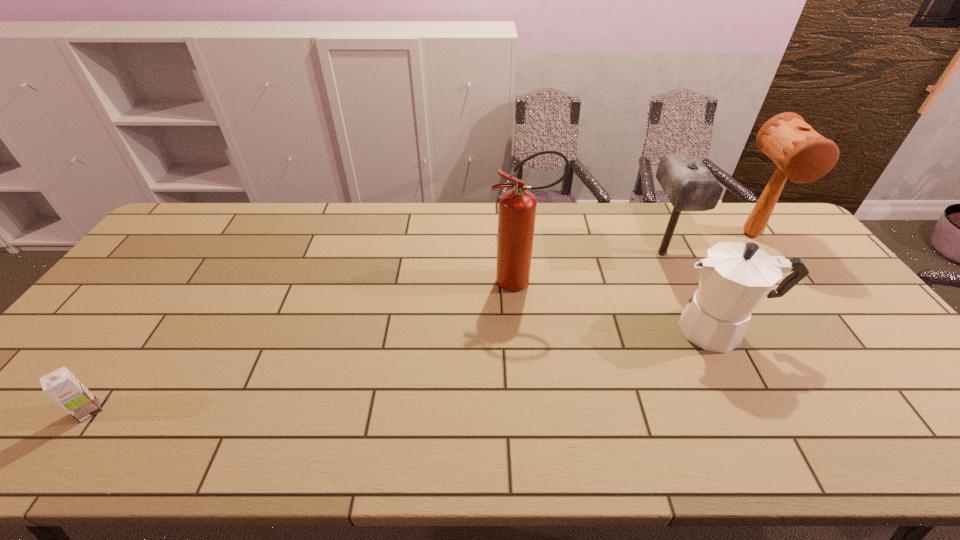
Where is `free space between the chocolate milk and the fourth tallest object`? This screenshot has width=960, height=540. free space between the chocolate milk and the fourth tallest object is located at coordinates (404, 370).

Where is `vacant space that is in between the left mallet and the coffeepot`? Image resolution: width=960 pixels, height=540 pixels. vacant space that is in between the left mallet and the coffeepot is located at coordinates (690, 291).

This screenshot has height=540, width=960. I want to click on free space between the shortest object and the rightmost object, so click(x=420, y=322).

What are the coordinates of `free space between the fourth farthest object and the leftmost object` in the screenshot? It's located at click(404, 370).

Select which object appears as the fourth closest to the left mallet. Please provide its 2D coordinates. Your answer should be formatted as a tuple, i.e. [(x, y)], where the tuple contains the x and y coordinates of a point satisfying the conditions above.

[(61, 385)]

At what (x,y) coordinates should I click in order to perform the action: click on object that stands as the closest to the shortest object. Please return your answer as a coordinate pair (x, y). This screenshot has width=960, height=540. Looking at the image, I should click on (517, 207).

You are a GUI agent. You are given a task and a screenshot of the screen. Output one action in this format:
    pyautogui.click(x=<x>, y=<y>)
    Task: Click on the free space that satisfies the following two spatial constraints: 1. on the strike surface of the rightmost object; 2. from the nozzle of the fire extinguisher
    Image resolution: width=960 pixels, height=540 pixels.
    Given the screenshot: What is the action you would take?
    pyautogui.click(x=786, y=281)

I want to click on vacant space that satisfies the following two spatial constraints: 1. on the back side of the leftmost object; 2. on the left side of the left mallet, so click(x=203, y=253).

This screenshot has width=960, height=540. What are the coordinates of `free space that satisfies the following two spatial constraints: 1. on the strike surface of the right mallet; 2. from the nozzle of the fire extinguisher` in the screenshot? It's located at (786, 281).

Where is `free space that satisfies the following two spatial constraints: 1. on the back side of the chocolate milk; 2. on the left side of the left mallet`? free space that satisfies the following two spatial constraints: 1. on the back side of the chocolate milk; 2. on the left side of the left mallet is located at coordinates (203, 253).